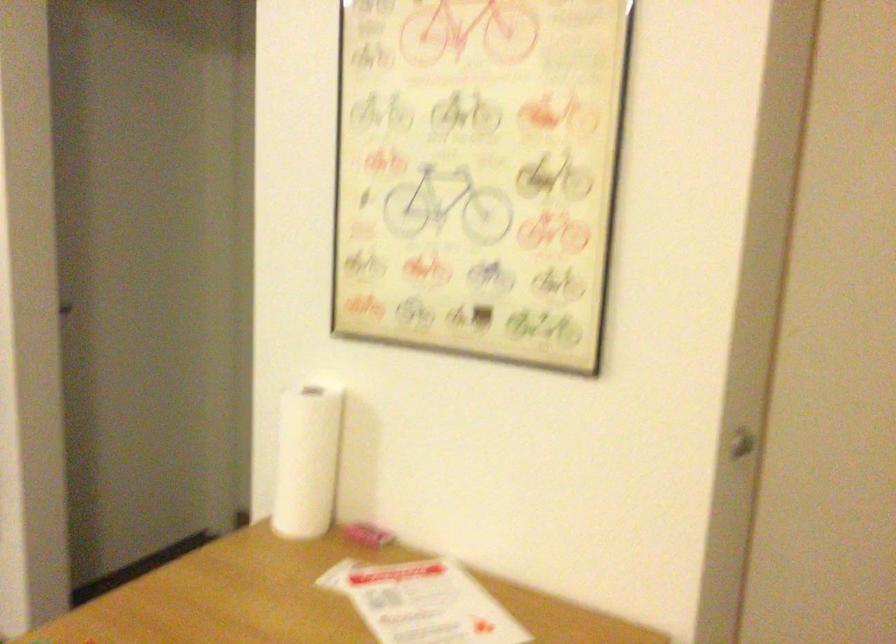
This screenshot has height=644, width=896. In order to click on door handle in this screenshot , I will do `click(742, 446)`.